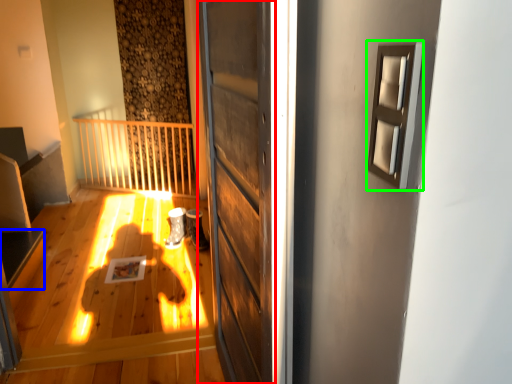
Question: Based on their relative distances, which object is nearer to door (highlighted by a red box)? Choose from stairwell (highlighted by a blue box) and window (highlighted by a green box).

Choices:
 (A) stairwell
 (B) window

Answer: (B)